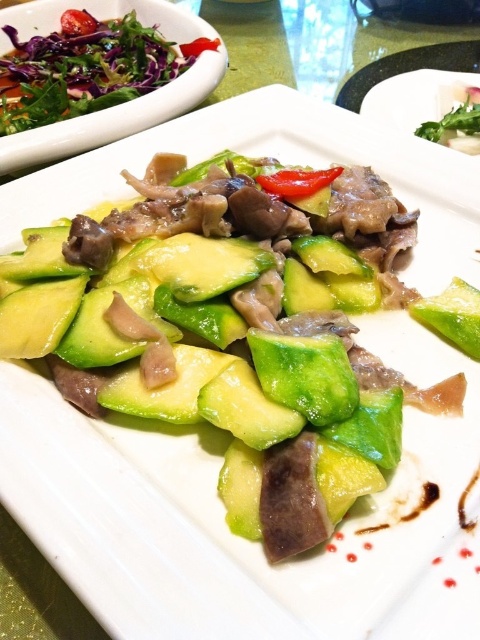
Question: Does fresh green salad at upper left have a lesser width compared to green leafy salad at upper left?

Choices:
 (A) no
 (B) yes

Answer: (A)

Question: Observing the image, what is the correct spatial positioning of fresh green salad at upper left in reference to green leafy salad at upper left?

Choices:
 (A) right
 (B) left

Answer: (B)

Question: Is fresh green salad at upper left positioned at the back of green leafy salad at upper left?

Choices:
 (A) no
 (B) yes

Answer: (A)

Question: Which of the following is the closest to the observer?

Choices:
 (A) fresh green salad at upper left
 (B) green leafy salad at upper left

Answer: (A)